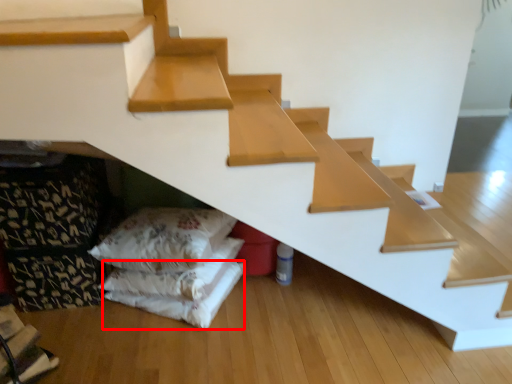
Question: From the image's perspective, considering the relative positions of sheet (annotated by the red box) and pillow in the image provided, where is sheet (annotated by the red box) located with respect to the staircase?

Choices:
 (A) below
 (B) above

Answer: (A)